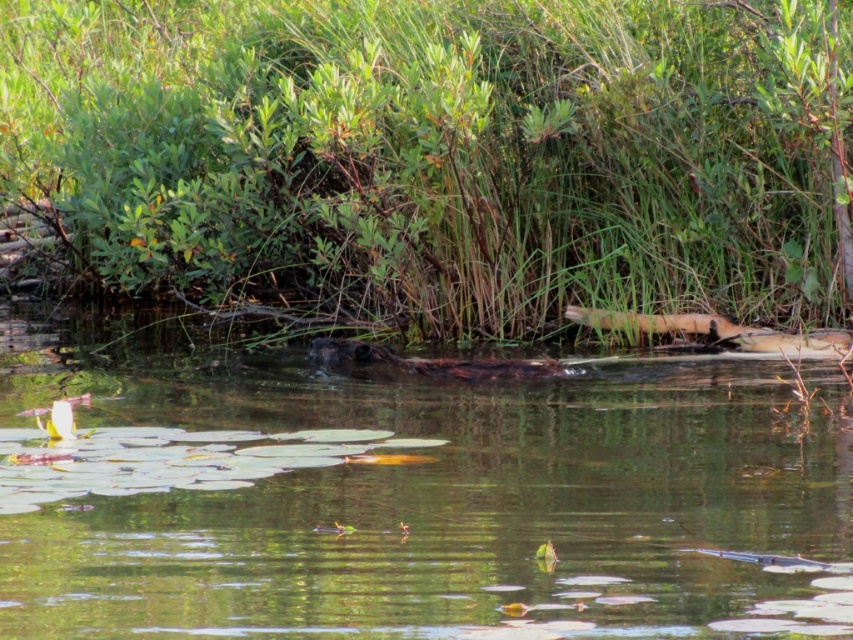
Is green leafy shrubs at center above brown furry beaver at center?

Yes.

Who is positioned more to the left, green leafy shrubs at center or brown furry beaver at center?

green leafy shrubs at center

At what (x,y) coordinates should I click in order to perform the action: click on green leafy shrubs at center. Please return your answer as a coordinate pair (x, y). The image size is (853, 640). Looking at the image, I should click on (433, 156).

The height and width of the screenshot is (640, 853). I want to click on green leafy shrubs at center, so click(433, 156).